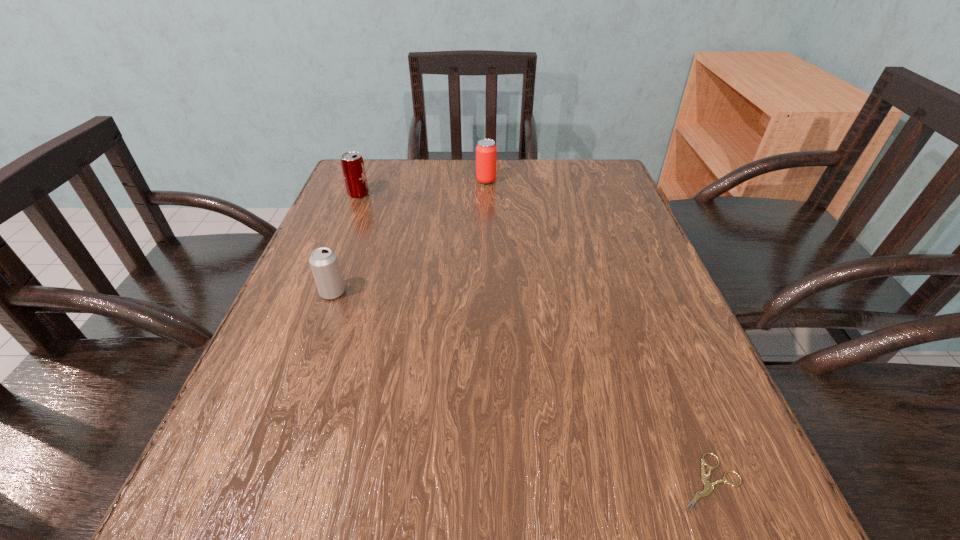
Find the location of a particular element. The image size is (960, 540). object located in the near edge section of the desktop is located at coordinates (708, 487).

Find the location of a particular element. Image resolution: width=960 pixels, height=540 pixels. object at the right edge is located at coordinates (708, 487).

I want to click on object present at the far left corner, so [352, 163].

Locate an element on the screen. The image size is (960, 540). object situated at the near right corner is located at coordinates (708, 487).

Locate an element on the screen. blank area at the far edge is located at coordinates (418, 169).

This screenshot has width=960, height=540. What are the coordinates of `blank space at the near edge of the desktop` in the screenshot? It's located at (526, 521).

You are a GUI agent. You are given a task and a screenshot of the screen. Output one action in this format:
    pyautogui.click(x=<x>, y=<y>)
    Task: Click on the free region at the left edge of the desktop
    The image size is (960, 540).
    Given the screenshot: What is the action you would take?
    pyautogui.click(x=269, y=401)

Locate an element on the screen. Image resolution: width=960 pixels, height=540 pixels. free location at the right edge of the desktop is located at coordinates (589, 260).

The image size is (960, 540). I want to click on vacant space at the far left corner, so click(x=393, y=178).

Locate an element on the screen. Image resolution: width=960 pixels, height=540 pixels. vacant space at the far right corner is located at coordinates (576, 193).